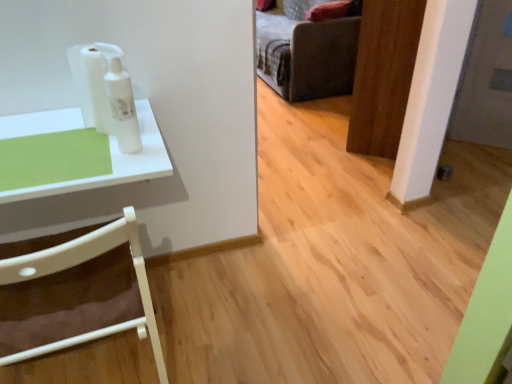
Image resolution: width=512 pixels, height=384 pixels. What are the coordinates of `free space underneath white plastic chair at left (from a real-world perspective)` in the screenshot? It's located at (90, 361).